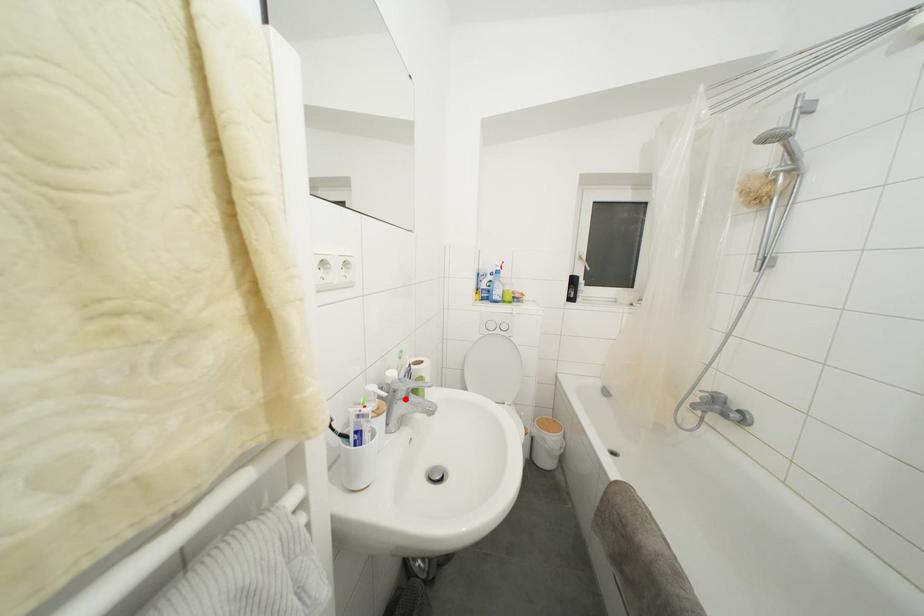
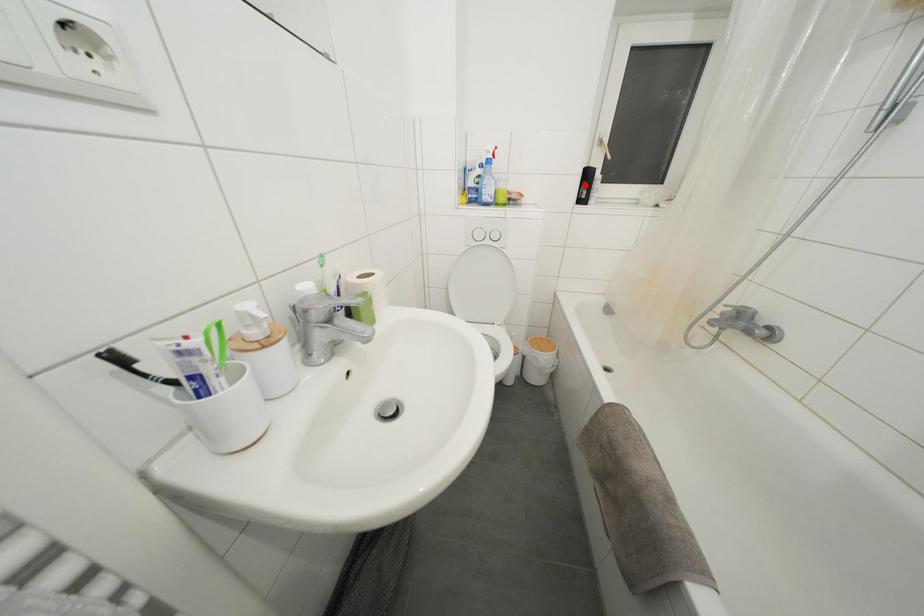
I am providing you with two images of the same scene from different viewpoints. A red point is marked on the first image and another point is marked on the second image. Are the points marked in image1 and image2 representing the same 3D position?

No